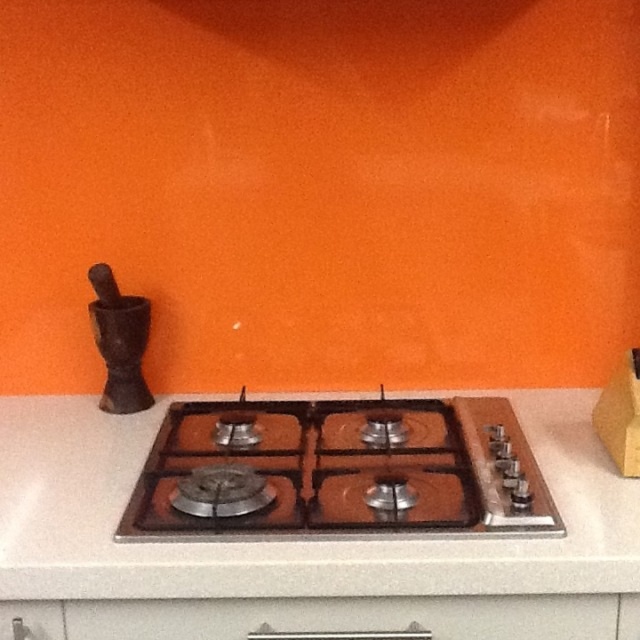
You are a chef preparing to place a large pot on the satin silver gas stove at center. The pot has a diameter of 14 inches. Can you safely place it on the stove without it hanging over the edge towards the brushed metal drawer at lower left?

The distance between the satin silver gas stove at center and the brushed metal drawer at lower left is 16.10 inches. Since the pot has a diameter of 14 inches, placing it on the stove towards the drawer side would leave approximately 2.1 inches of space between the pot and the drawer. This should be sufficient to prevent the pot from hanging over the edge and ensure safe placement.

You are standing in the kitchen and want to reach the satin silver gas stove at center to adjust the burner. Considering your arm length is 28 inches, can you comfortably reach it without moving closer?

The satin silver gas stove at center is 36.72 inches away from the viewer. Since your arm length is 28 inches, you cannot comfortably reach it without moving closer as the stove is further away than your arm can extend.

You are a chef standing in front of the kitchen. You need to reach the satin silver gas stove at center to adjust the flame. Considering your arm can reach up to 28 inches, will you be able to adjust the stove without moving closer?

The satin silver gas stove at center is 36.72 inches from the viewer. Since your arm can only reach up to 28 inches, you will need to move closer to reach it.